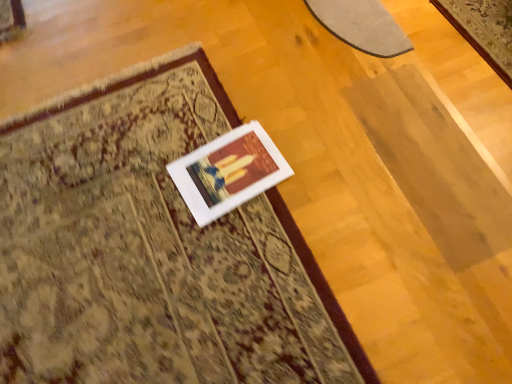
Where is `free spot above white matte picture frame at center (from a real-world perspective)`? free spot above white matte picture frame at center (from a real-world perspective) is located at coordinates (231, 169).